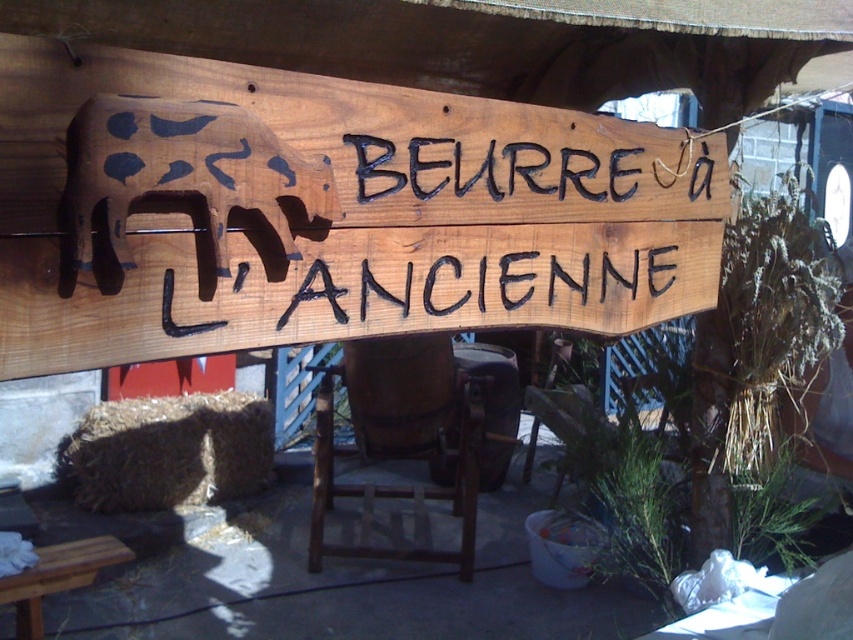
Question: Can you confirm if wooden sign at center is positioned below wooden stool at lower left?

Choices:
 (A) yes
 (B) no

Answer: (B)

Question: Considering the relative positions of brown wooden cow at left and brown straw bale at lower left in the image provided, where is brown wooden cow at left located with respect to brown straw bale at lower left?

Choices:
 (A) above
 (B) below

Answer: (A)

Question: Based on their relative distances, which object is farther from the brown wooden cow at left?

Choices:
 (A) wooden stool at lower left
 (B) brown straw bale at lower left
 (C) wooden sign at center

Answer: (B)

Question: Which of the following is the farthest from the observer?

Choices:
 (A) coord(90,253)
 (B) coord(91,266)

Answer: (B)

Question: Which point is closer to the camera?

Choices:
 (A) wooden sign at center
 (B) brown straw bale at lower left

Answer: (A)

Question: Does brown wooden cow at left lie behind wooden stool at lower left?

Choices:
 (A) no
 (B) yes

Answer: (A)